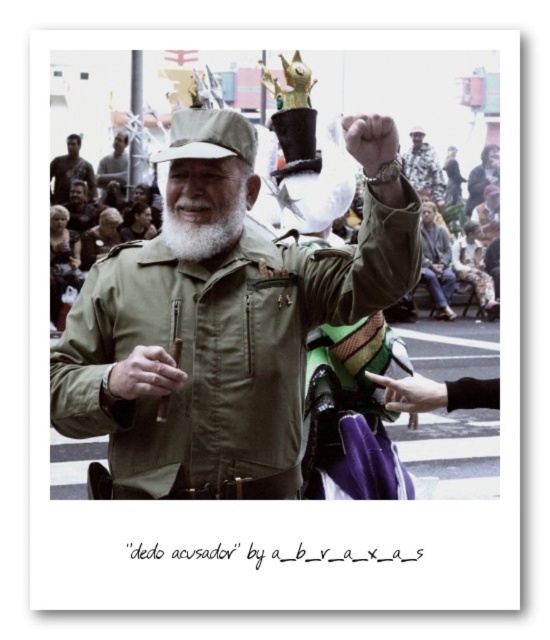
You are a photographer at the event and want to capture a photo that includes both the smooth skin hand at lower right and the matte black cap at upper center. Based on their positions, which object should you ensure is placed lower in the frame?

The smooth skin hand at lower right should be placed lower in the frame because it is positioned below the matte black cap at upper center.

You are a photographer trying to capture the scene. You notice the leather textured glove at center and the matte black cap at upper center. Which object is positioned to the right side of the other?

The leather textured glove at center is to the right of the matte black cap at upper center.